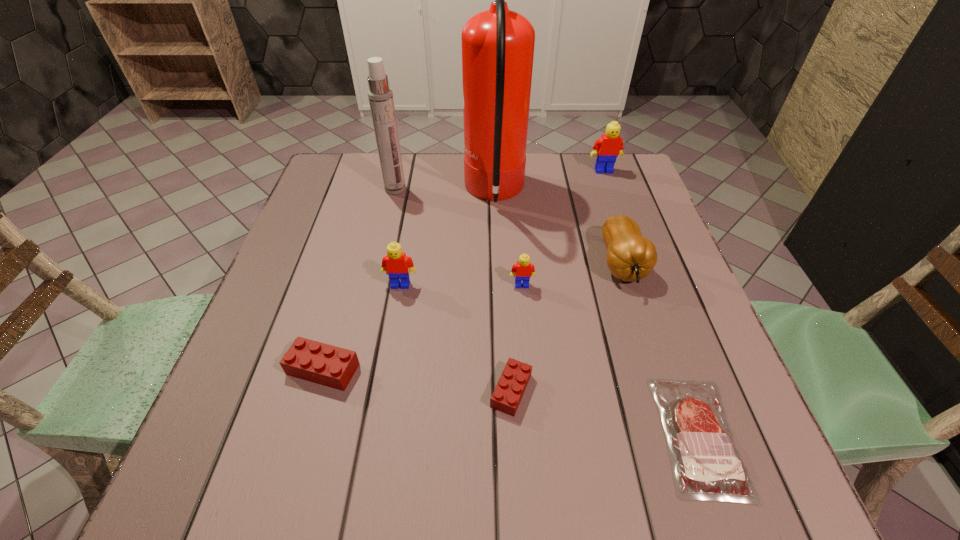
Locate an element on the screen. This screenshot has width=960, height=540. vacant area at the right edge of the desktop is located at coordinates (691, 352).

At what (x,y) coordinates should I click in order to perform the action: click on vacant space at the far left corner of the desktop. Please return your answer as a coordinate pair (x, y). Looking at the image, I should click on (341, 170).

Where is `vacant space at the far right corner of the desktop`? vacant space at the far right corner of the desktop is located at coordinates (591, 163).

Find the location of `free space between the tallest object and the leftmost yellow Lego`. free space between the tallest object and the leftmost yellow Lego is located at coordinates (447, 239).

Identify the location of free space that is in between the red fire extinguisher and the second tallest Lego. This screenshot has width=960, height=540. (447, 239).

The height and width of the screenshot is (540, 960). I want to click on vacant area that lies between the gourd and the steak, so click(x=660, y=350).

Where is `free area in between the tallest object and the gourd`? free area in between the tallest object and the gourd is located at coordinates (559, 229).

Image resolution: width=960 pixels, height=540 pixels. What are the coordinates of `empty space that is in between the fourth shortest object and the rightmost Lego` in the screenshot? It's located at (563, 228).

Identify the location of free space between the biggest yellow Lego and the eighth tallest object. The image size is (960, 540). (558, 281).

The height and width of the screenshot is (540, 960). I want to click on unoccupied position between the red fire extinguisher and the second smallest yellow Lego, so click(x=447, y=239).